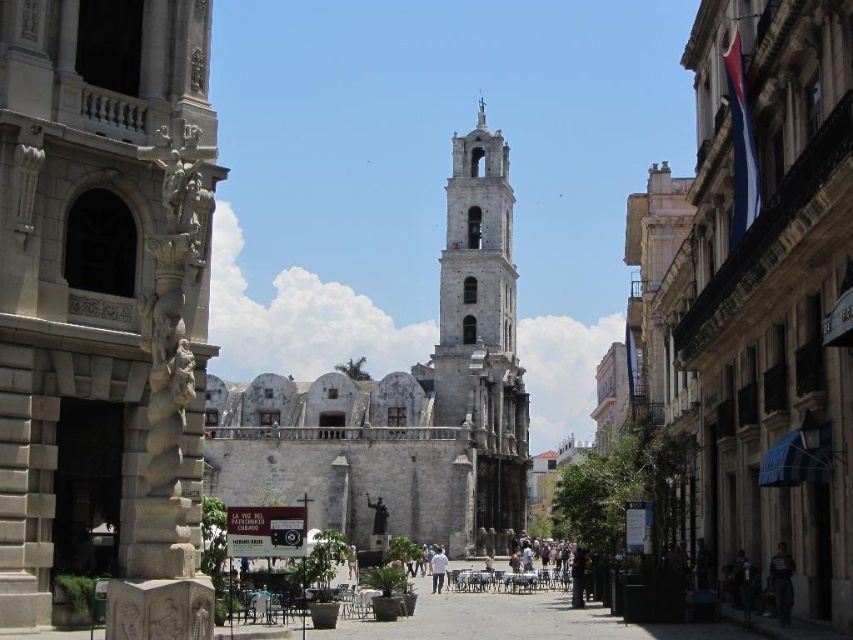
Question: Which object appears closest to the camera in this image?

Choices:
 (A) gray stone church at center
 (B) dark gray fabric jacket at lower right

Answer: (B)

Question: Considering the real-world distances, which object is farthest from the gray stone church at center?

Choices:
 (A) bronze statue at center
 (B) dark gray fabric jacket at lower right
 (C) stone church at center

Answer: (B)

Question: Can you confirm if gray stone church at center is positioned to the right of white cotton shirt at center?

Choices:
 (A) no
 (B) yes

Answer: (A)

Question: Among these points, which one is nearest to the camera?

Choices:
 (A) (73, 340)
 (B) (352, 577)
 (C) (782, 604)

Answer: (A)

Question: Can you confirm if gray stone church at center is positioned to the right of bronze statue at center?

Choices:
 (A) yes
 (B) no

Answer: (A)

Question: Can you confirm if white stone bell tower at center is positioned below white cotton shirt at center?

Choices:
 (A) no
 (B) yes

Answer: (A)